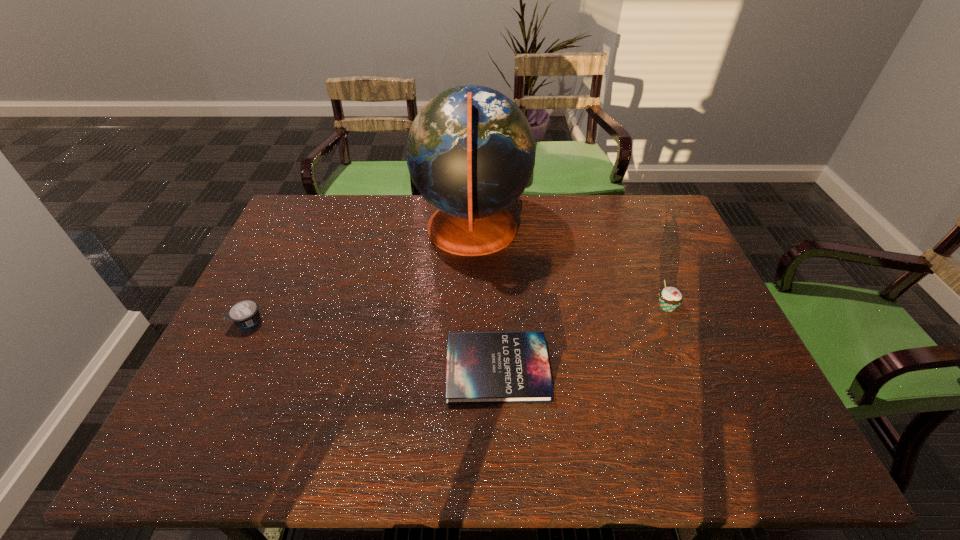
Identify which object is located as the nearest to the yogurt. Please provide its 2D coordinates. Your answer should be formatted as a tuple, i.e. [(x, y)], where the tuple contains the x and y coordinates of a point satisfying the conditions above.

[(470, 151)]

The height and width of the screenshot is (540, 960). I want to click on vacant position in the image that satisfies the following two spatial constraints: 1. on the back side of the cupcake; 2. with the Americas facing the viewer on the globe, so click(635, 230).

I want to click on free space that satisfies the following two spatial constraints: 1. with the Americas facing the viewer on the tallest object; 2. on the back side of the third shortest object, so click(x=470, y=307).

This screenshot has width=960, height=540. I want to click on free space that satisfies the following two spatial constraints: 1. with the Americas facing the viewer on the globe; 2. on the right side of the nearest object, so click(469, 369).

This screenshot has height=540, width=960. Identify the location of blank space that satisfies the following two spatial constraints: 1. on the back side of the shortest object; 2. on the left side of the rightmost object. (495, 307).

Locate an element on the screen. This screenshot has height=540, width=960. vacant area that satisfies the following two spatial constraints: 1. on the back side of the rightmost object; 2. on the right side of the third tallest object is located at coordinates (255, 307).